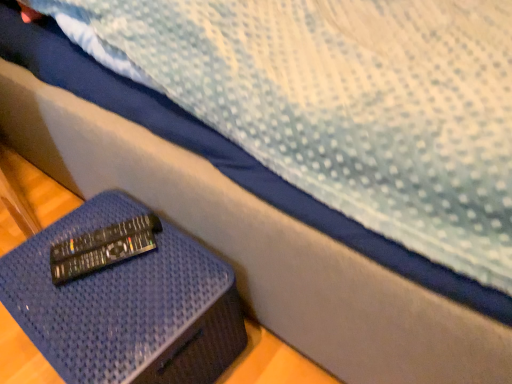
What do you see at coordinates (104, 237) in the screenshot? This screenshot has height=384, width=512. I see `black plastic remote at lower left, acting as the 2th remote starting from the front` at bounding box center [104, 237].

In order to face blue textured ottoman at lower left, should I rotate leftwards or rightwards?

Rotate left and turn 17.550 degrees.

At what (x,y) coordinates should I click in order to perform the action: click on black plastic remote at lower left, acting as the 1th remote starting from the back. Please return your answer as a coordinate pair (x, y). The height and width of the screenshot is (384, 512). Looking at the image, I should click on (104, 237).

Where is `furniture lying on the right of black plastic remote at lower left, the second remote viewed from the back`? This screenshot has height=384, width=512. furniture lying on the right of black plastic remote at lower left, the second remote viewed from the back is located at coordinates [127, 305].

In the image, is blue textured ottoman at lower left positioned in front of or behind black plastic remote at lower left, the second remote viewed from the back?

blue textured ottoman at lower left is in front of black plastic remote at lower left, the second remote viewed from the back.

Can you tell me how much blue textured ottoman at lower left and black plastic remote at lower left, which is the first remote from front to back, differ in facing direction?

28.1 degrees.

In the scene shown: Who is smaller, blue textured ottoman at lower left or black plastic remote at lower left, which is the first remote from front to back?

With smaller size is black plastic remote at lower left, which is the first remote from front to back.

Consider the image. From the image's perspective, is black plastic remote at lower left, the second remote viewed from the back, beneath black plastic remote at lower left, acting as the 2th remote starting from the front?

Yes, from the image's perspective, black plastic remote at lower left, the second remote viewed from the back, is below black plastic remote at lower left, acting as the 2th remote starting from the front.

Consider the image. Is black plastic remote at lower left, which is the first remote from front to back, smaller than black plastic remote at lower left, acting as the 2th remote starting from the front?

Incorrect, black plastic remote at lower left, which is the first remote from front to back, is not smaller in size than black plastic remote at lower left, acting as the 2th remote starting from the front.

Does black plastic remote at lower left, which is the first remote from front to back, have a lesser width compared to black plastic remote at lower left, acting as the 1th remote starting from the back?

Correct, the width of black plastic remote at lower left, which is the first remote from front to back, is less than that of black plastic remote at lower left, acting as the 1th remote starting from the back.

Is black plastic remote at lower left, which is the first remote from front to back, at the left side of black plastic remote at lower left, acting as the 1th remote starting from the back?

No, black plastic remote at lower left, which is the first remote from front to back, is not to the left of black plastic remote at lower left, acting as the 1th remote starting from the back.

Does blue textured ottoman at lower left have a lesser height compared to black plastic remote at lower left, acting as the 2th remote starting from the front?

No.

Which of these two, blue textured ottoman at lower left or black plastic remote at lower left, acting as the 2th remote starting from the front, is smaller?

black plastic remote at lower left, acting as the 2th remote starting from the front.

Is blue textured ottoman at lower left facing towards black plastic remote at lower left, acting as the 1th remote starting from the back?

No, blue textured ottoman at lower left is not turned towards black plastic remote at lower left, acting as the 1th remote starting from the back.

This screenshot has width=512, height=384. I want to click on furniture below the black plastic remote at lower left, acting as the 2th remote starting from the front (from a real-world perspective), so click(127, 305).

Can we say black plastic remote at lower left, the second remote viewed from the back, lies outside blue textured ottoman at lower left?

Absolutely, black plastic remote at lower left, the second remote viewed from the back, is external to blue textured ottoman at lower left.

Between point (90, 253) and point (77, 300), which one is positioned behind?

The point (90, 253) is more distant.

This screenshot has height=384, width=512. In the image, there is a black plastic remote at lower left, the second remote viewed from the back. What are the coordinates of `furniture below it (from a real-world perspective)` in the screenshot? It's located at (127, 305).

In the scene shown: Considering the sizes of objects black plastic remote at lower left, the second remote viewed from the back, and blue textured ottoman at lower left in the image provided, who is taller, black plastic remote at lower left, the second remote viewed from the back, or blue textured ottoman at lower left?

blue textured ottoman at lower left is taller.

Can you confirm if black plastic remote at lower left, acting as the 2th remote starting from the front, is thinner than blue textured ottoman at lower left?

Yes, black plastic remote at lower left, acting as the 2th remote starting from the front, is thinner than blue textured ottoman at lower left.

From the image's perspective, between black plastic remote at lower left, acting as the 1th remote starting from the back, and blue textured ottoman at lower left, which one is located above?

From the image's view, black plastic remote at lower left, acting as the 1th remote starting from the back, is above.

Considering the positions of objects black plastic remote at lower left, acting as the 1th remote starting from the back, and blue textured ottoman at lower left in the image provided, who is behind, black plastic remote at lower left, acting as the 1th remote starting from the back, or blue textured ottoman at lower left?

black plastic remote at lower left, acting as the 1th remote starting from the back, is further from the camera.

Can you confirm if black plastic remote at lower left, acting as the 2th remote starting from the front, is positioned to the right of blue textured ottoman at lower left?

Incorrect, black plastic remote at lower left, acting as the 2th remote starting from the front, is not on the right side of blue textured ottoman at lower left.

Is black plastic remote at lower left, acting as the 1th remote starting from the back, positioned beyond the bounds of black plastic remote at lower left, the second remote viewed from the back?

Yes, black plastic remote at lower left, acting as the 1th remote starting from the back, is located beyond the bounds of black plastic remote at lower left, the second remote viewed from the back.

From a real-world perspective, is black plastic remote at lower left, acting as the 1th remote starting from the back, above or below black plastic remote at lower left, the second remote viewed from the back?

In terms of real-world spatial position, black plastic remote at lower left, acting as the 1th remote starting from the back, is above black plastic remote at lower left, the second remote viewed from the back.

Can you confirm if black plastic remote at lower left, acting as the 1th remote starting from the back, is thinner than black plastic remote at lower left, which is the first remote from front to back?

In fact, black plastic remote at lower left, acting as the 1th remote starting from the back, might be wider than black plastic remote at lower left, which is the first remote from front to back.

Which is more to the right, black plastic remote at lower left, acting as the 2th remote starting from the front, or black plastic remote at lower left, which is the first remote from front to back?

Positioned to the right is black plastic remote at lower left, which is the first remote from front to back.

Where is `the 1st remote directly above the blue textured ottoman at lower left (from a real-world perspective)`? This screenshot has width=512, height=384. the 1st remote directly above the blue textured ottoman at lower left (from a real-world perspective) is located at coordinates (97, 252).

The height and width of the screenshot is (384, 512). Identify the location of remote on the left of black plastic remote at lower left, the second remote viewed from the back. (104, 237).

Based on their spatial positions, is black plastic remote at lower left, the second remote viewed from the back, or blue textured ottoman at lower left further from black plastic remote at lower left, acting as the 1th remote starting from the back?

blue textured ottoman at lower left is positioned further to the anchor black plastic remote at lower left, acting as the 1th remote starting from the back.

Considering their positions, is black plastic remote at lower left, acting as the 1th remote starting from the back, positioned closer to blue textured ottoman at lower left than black plastic remote at lower left, which is the first remote from front to back?

Among the two, black plastic remote at lower left, which is the first remote from front to back, is located nearer to blue textured ottoman at lower left.

Considering their positions, is blue textured ottoman at lower left positioned further to black plastic remote at lower left, acting as the 1th remote starting from the back, than black plastic remote at lower left, the second remote viewed from the back?

blue textured ottoman at lower left is positioned further to the anchor black plastic remote at lower left, acting as the 1th remote starting from the back.

Looking at the image, which one is located closer to black plastic remote at lower left, the second remote viewed from the back, black plastic remote at lower left, acting as the 1th remote starting from the back, or blue textured ottoman at lower left?

black plastic remote at lower left, acting as the 1th remote starting from the back, is positioned closer to the anchor black plastic remote at lower left, the second remote viewed from the back.

Looking at the image, which one is located further to black plastic remote at lower left, which is the first remote from front to back, blue textured ottoman at lower left or black plastic remote at lower left, acting as the 1th remote starting from the back?

Among the two, blue textured ottoman at lower left is located further to black plastic remote at lower left, which is the first remote from front to back.

Estimate the real-world distances between objects in this image. Which object is closer to blue textured ottoman at lower left, black plastic remote at lower left, which is the first remote from front to back, or black plastic remote at lower left, acting as the 1th remote starting from the back?

black plastic remote at lower left, which is the first remote from front to back, lies closer to blue textured ottoman at lower left than the other object.

I want to click on remote between blue textured ottoman at lower left and black plastic remote at lower left, acting as the 1th remote starting from the back, from front to back, so click(97, 252).